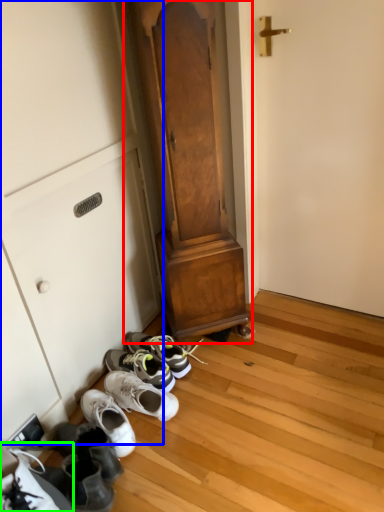
Question: Which is nearer to the dresser (highlighted by a red box)? cabinetry (highlighted by a blue box) or footwear (highlighted by a green box).

Choices:
 (A) cabinetry
 (B) footwear

Answer: (A)